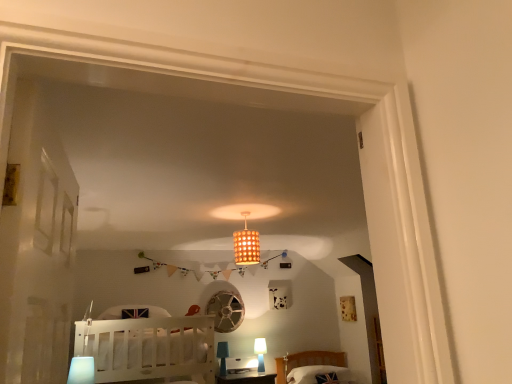
You are a GUI agent. You are given a task and a screenshot of the screen. Output one action in this format:
    pyautogui.click(x=<x>, y=<y>)
    Task: Click on the vacant point above wooden textured lampshade at center, the third lamp in the back-to-front sequence (from a real-world perspective)
    The height and width of the screenshot is (384, 512).
    Given the screenshot: What is the action you would take?
    pyautogui.click(x=240, y=213)